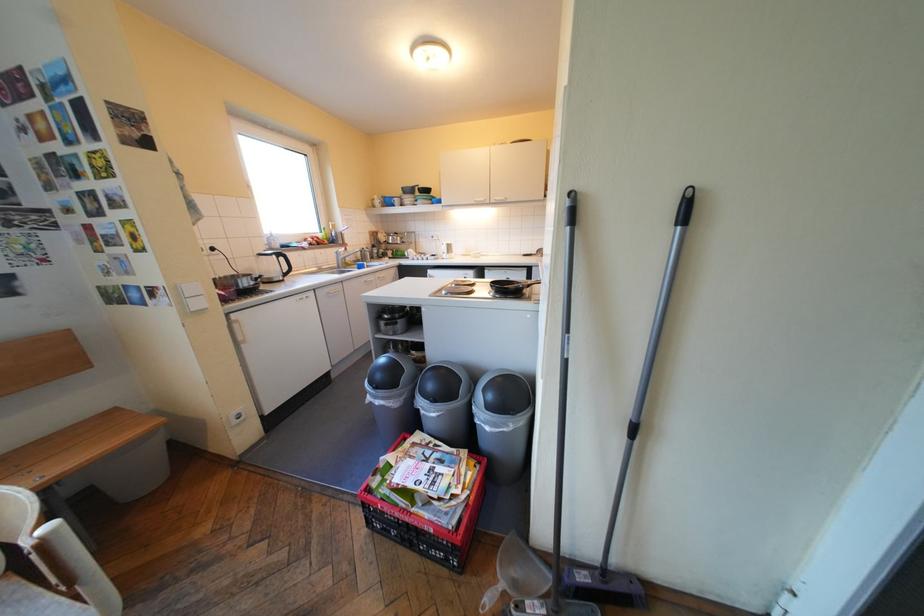
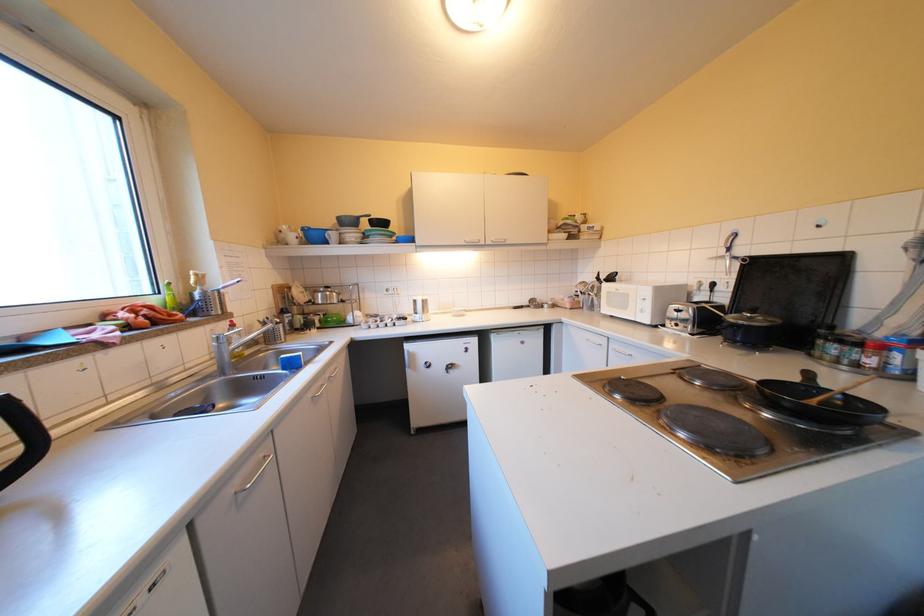
Find the pixel in the second image that matches (298,273) in the first image.

(17, 479)